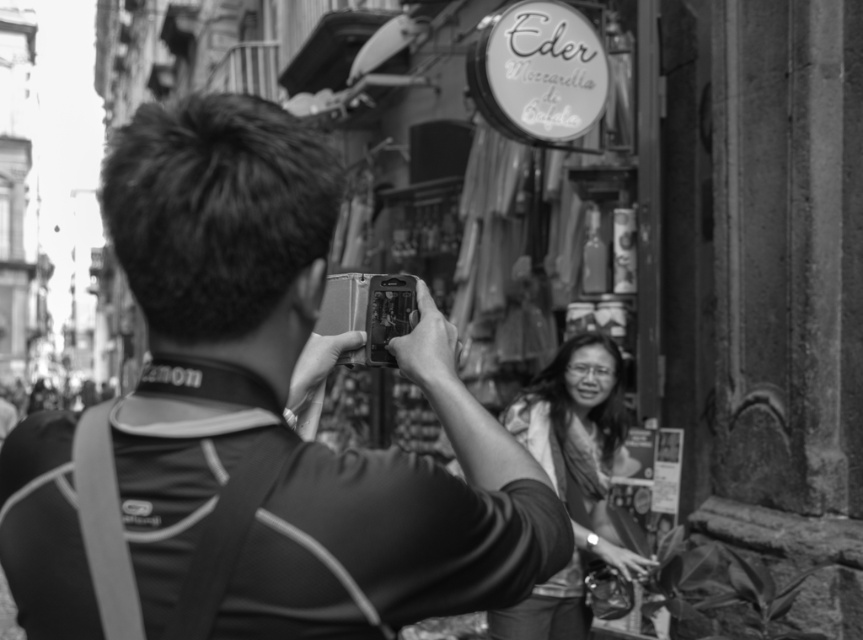
Between matte black camera at center and smooth fabric blouse at center, which one appears on the left side from the viewer's perspective?

matte black camera at center

Image resolution: width=863 pixels, height=640 pixels. What do you see at coordinates (285, 406) in the screenshot? I see `matte black camera at center` at bounding box center [285, 406].

Does point (11, 563) come closer to viewer compared to point (496, 611)?

Yes, it is in front of point (496, 611).

Find the location of `matte black camera at center`. matte black camera at center is located at coordinates (285, 406).